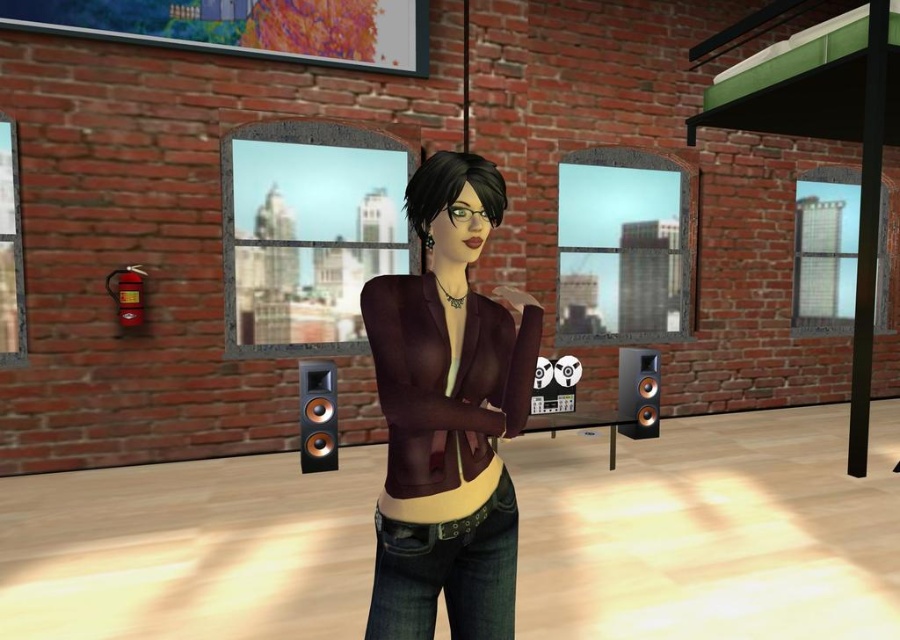
You are a character in the room and want to look out the matte glass window at center without moving your body. Can you see the denim jeans at center through the window?

The matte glass window at center is further to the viewer than denim jeans at center, so the window is between you and the jeans. Therefore, you cannot see the denim jeans at center through the window because the window is in front of it.